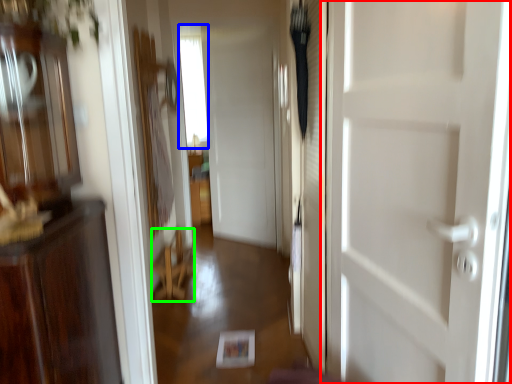
Question: Estimate the real-world distances between objects in this image. Which object is farther from door (highlighted by a red box), window (highlighted by a blue box) or furniture (highlighted by a green box)?

Choices:
 (A) window
 (B) furniture

Answer: (A)